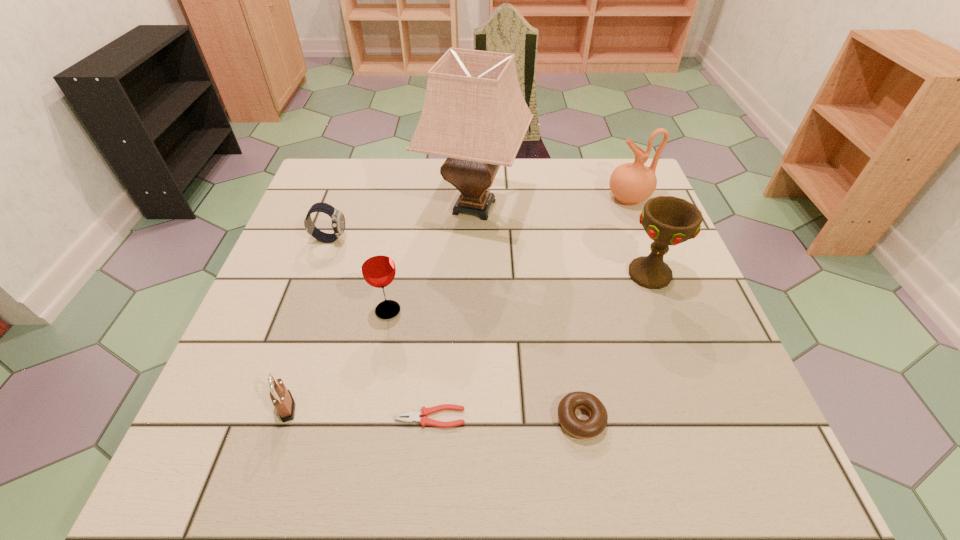
I want to click on free space at the right edge of the desktop, so coord(605,215).

At what (x,y) coordinates should I click in order to perform the action: click on vacant space at the far left corner. Please return your answer as a coordinate pair (x, y). Looking at the image, I should click on (327, 162).

You are a GUI agent. You are given a task and a screenshot of the screen. Output one action in this format:
    pyautogui.click(x=<x>, y=<y>)
    Task: Click on the vacant space at the near right corner of the desktop
    
    Given the screenshot: What is the action you would take?
    pyautogui.click(x=773, y=476)

At what (x,y) coordinates should I click in order to perform the action: click on vacant area that lies between the chalice and the sixth object from left to right. Please return your answer as a coordinate pair (x, y). This screenshot has width=960, height=540. Looking at the image, I should click on (615, 347).

Locate an element on the screen. This screenshot has height=540, width=960. empty space between the fifth nearest object and the pliers is located at coordinates (540, 346).

At what (x,y) coordinates should I click in order to perform the action: click on free spot between the chalice and the doughnut. Please return your answer as a coordinate pair (x, y). Looking at the image, I should click on (615, 347).

I want to click on free spot between the fourth nearest object and the pottery, so click(508, 254).

At what (x,y) coordinates should I click in order to perform the action: click on free spot between the doughnut and the fifth nearest object. Please return your answer as a coordinate pair (x, y). This screenshot has width=960, height=540. Looking at the image, I should click on (615, 347).

At what (x,y) coordinates should I click in order to perform the action: click on vacant region between the pottery and the tallest object. Please return your answer as a coordinate pair (x, y). Image resolution: width=960 pixels, height=540 pixels. Looking at the image, I should click on (551, 202).

Locate an element on the screen. The image size is (960, 540). vacant point located between the lampshade and the shortest object is located at coordinates (452, 312).